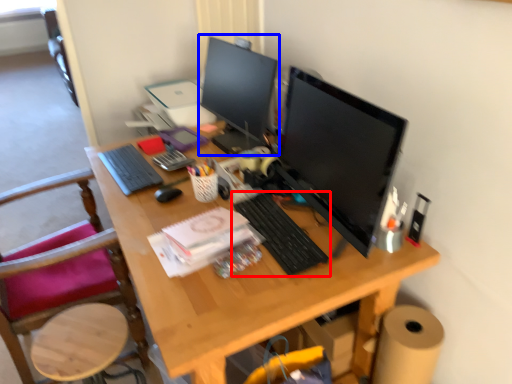
Question: Among these objects, which one is farthest to the camera, computer keyboard (highlighted by a red box) or computer monitor (highlighted by a blue box)?

Choices:
 (A) computer keyboard
 (B) computer monitor

Answer: (B)